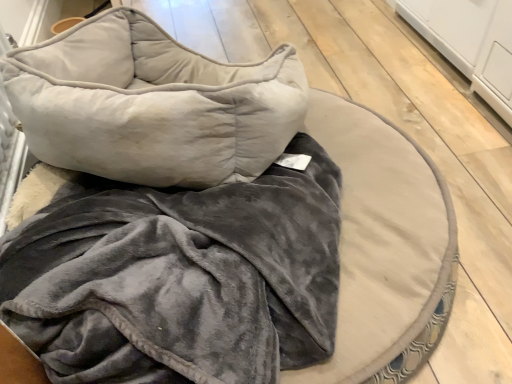
Image resolution: width=512 pixels, height=384 pixels. In order to click on velvet gray pillow at center in this screenshot , I will do `click(152, 104)`.

Describe the element at coordinates (152, 104) in the screenshot. Image resolution: width=512 pixels, height=384 pixels. I see `velvet gray pillow at center` at that location.

The height and width of the screenshot is (384, 512). I want to click on velvet gray pillow at center, so click(152, 104).